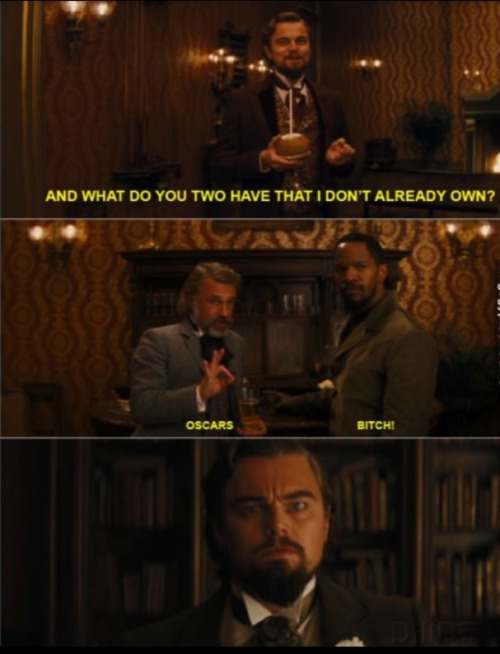
Locate an element on the screen. Image resolution: width=500 pixels, height=654 pixels. fire place is located at coordinates (478, 133).